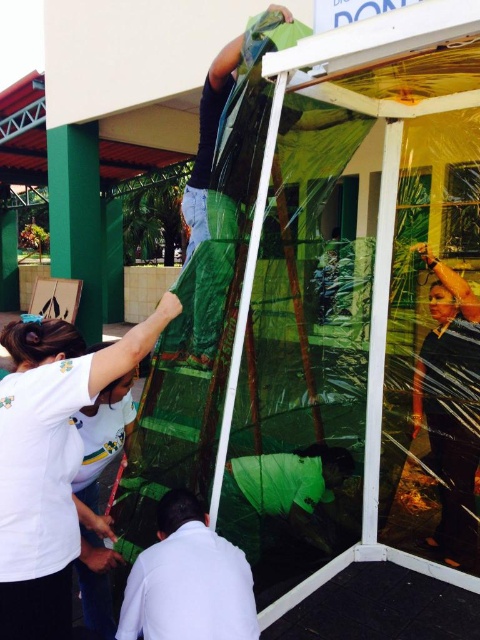
Is white matte shirt at upper left above shiny black hair at center?

Correct, white matte shirt at upper left is located above shiny black hair at center.

The image size is (480, 640). I want to click on white matte shirt at upper left, so click(50, 461).

Describe the element at coordinates (50, 461) in the screenshot. The image size is (480, 640). I see `white matte shirt at upper left` at that location.

At what (x,y) coordinates should I click in order to perform the action: click on white matte shirt at upper left. Please return your answer as a coordinate pair (x, y). The height and width of the screenshot is (640, 480). Looking at the image, I should click on (50, 461).

The height and width of the screenshot is (640, 480). In order to click on shiny black hair at center in this screenshot , I will do `click(451, 406)`.

Is point (469, 316) closer to viewer compared to point (228, 630)?

No, (469, 316) is further to viewer.

Identify the location of shiny black hair at center. This screenshot has height=640, width=480. (451, 406).